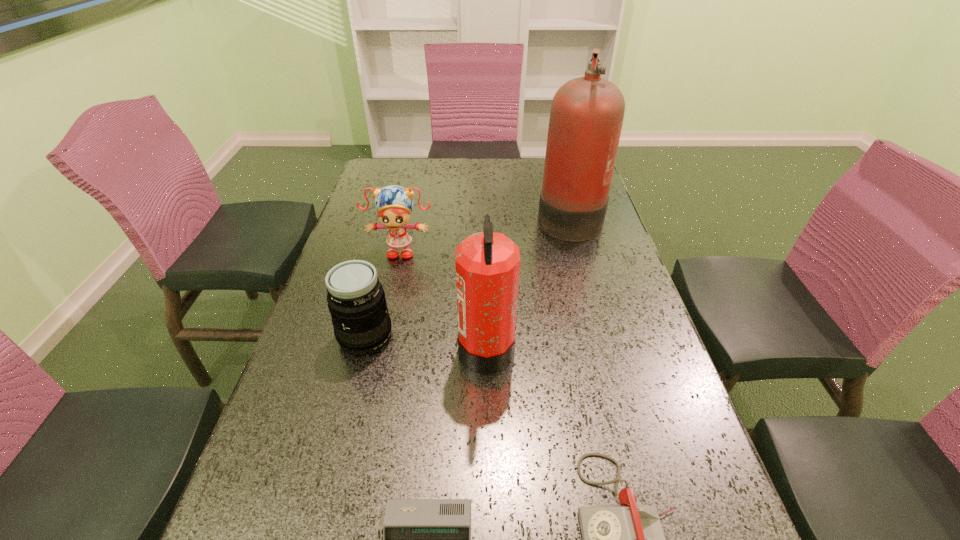
At what (x,y) coordinates should I click in order to perform the action: click on the tallest object. Please return your answer as a coordinate pair (x, y). The image size is (960, 540). Looking at the image, I should click on (587, 113).

The image size is (960, 540). In order to click on the farther fire extinguisher in this screenshot , I will do `click(587, 113)`.

Identify the location of the left fire extinguisher. (487, 263).

The image size is (960, 540). What are the coordinates of `the second tallest object` in the screenshot? It's located at (487, 263).

Find the location of `doll`. doll is located at coordinates (394, 204).

The height and width of the screenshot is (540, 960). Identify the location of telephoto lens. (356, 300).

At what (x,y) coordinates should I click in order to perform the action: click on vacant space located 0.250m at the nozzle of the right fire extinguisher. Please return your answer as a coordinate pair (x, y). The width and height of the screenshot is (960, 540). Looking at the image, I should click on (457, 215).

Identify the location of blank space located at the nozzle of the right fire extinguisher. The width and height of the screenshot is (960, 540). (473, 215).

The height and width of the screenshot is (540, 960). I want to click on vacant region located at the nozzle of the right fire extinguisher, so click(x=473, y=215).

Locate an element on the screen. Image resolution: width=960 pixels, height=540 pixels. vacant space located on the front side of the second tallest object is located at coordinates (428, 347).